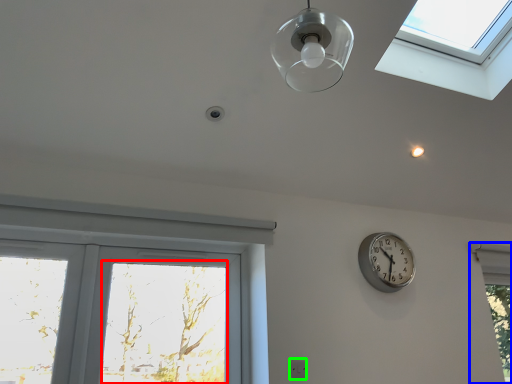
Question: Which object is the closest to the window screen (highlighted by a red box)? Choose among these: window (highlighted by a blue box) or electric outlet (highlighted by a green box).

Choices:
 (A) window
 (B) electric outlet

Answer: (B)